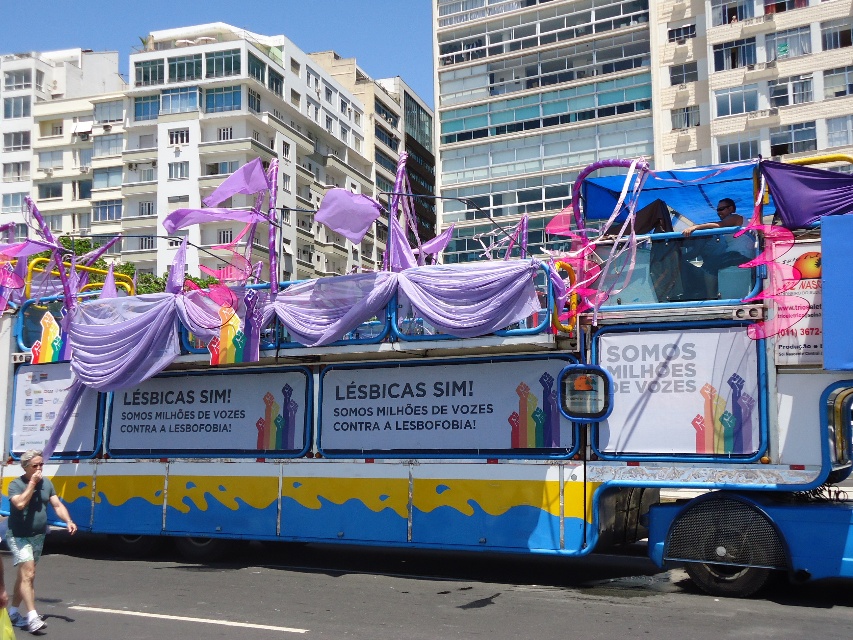
You are a photographer trying to capture the float from a low angle to highlight both the matte purple fabric at center and the gray fabric shorts at lower left. Which object should you focus on first to ensure both are in frame?

The matte purple fabric at center is above the gray fabric shorts at lower left, so you should focus on the gray fabric shorts at lower left first to ensure both are in frame.

You are a photographer standing at the edge of the parade route. You want to take a photo of both the matte purple fabric at center and the matte blue shirt at center so that they appear in the same frame. The camera you have can capture objects within a 5 feet range. Can you capture both objects in one shot?

The matte purple fabric at center is 4.10 feet away from the matte blue shirt at center. Since the distance between them is within the 5 feet range of your camera, you can capture both objects in one shot.